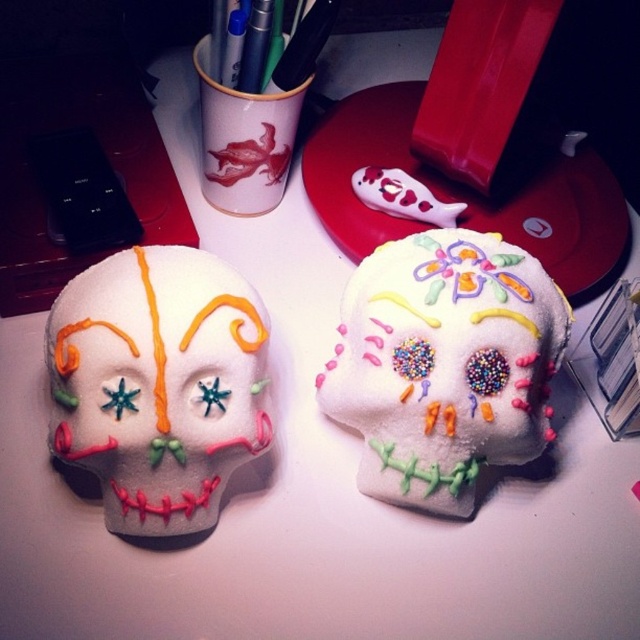
Question: Does sugary white skull at center have a larger size compared to green matte pen at upper center?

Choices:
 (A) no
 (B) yes

Answer: (B)

Question: Which object appears farthest from the camera in this image?

Choices:
 (A) sugary white skull at center
 (B) green matte pen at upper center

Answer: (B)

Question: Among these points, which one is nearest to the camera?

Choices:
 (A) (273, 83)
 (B) (522, 401)
 (C) (195, 426)

Answer: (C)

Question: Which point is farther to the camera?

Choices:
 (A) sugary white skull at center
 (B) matte sugar skull at center
 (C) green matte pen at upper center

Answer: (C)

Question: Does sugary white skull at center lie in front of green matte pen at upper center?

Choices:
 (A) no
 (B) yes

Answer: (B)

Question: Is sugary white skull at center smaller than matte sugar skull at center?

Choices:
 (A) yes
 (B) no

Answer: (B)